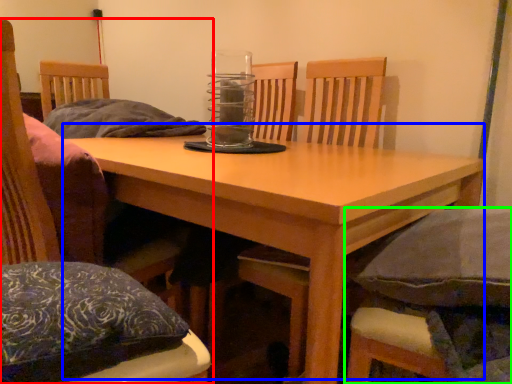
Question: Which object is positioned farthest from chair (highlighted by a red box)? Select from table (highlighted by a blue box) and chair (highlighted by a green box).

Choices:
 (A) table
 (B) chair

Answer: (B)